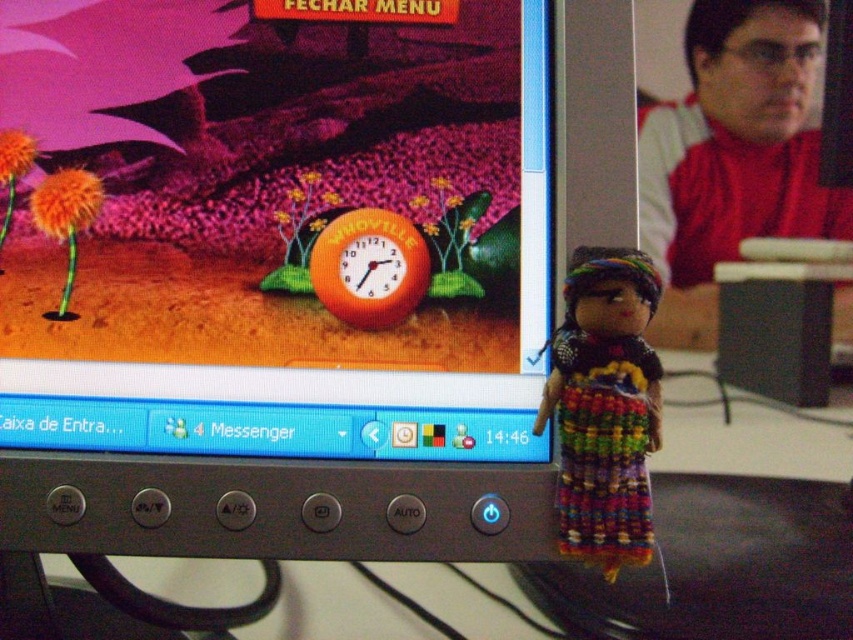
Question: Among these objects, which one is nearest to the camera?

Choices:
 (A) matte plastic monitor at center
 (B) fluffy orange flower at left

Answer: (A)

Question: Based on their relative distances, which object is farther from the knitted multicolored doll at right?

Choices:
 (A) fluffy orange flower at left
 (B) matte plastic monitor at center

Answer: (A)

Question: Can you confirm if orange fabric clock at center is wider than fluffy orange flower at left?

Choices:
 (A) yes
 (B) no

Answer: (A)

Question: Is smooth red shirt at right above orange fabric clock at center?

Choices:
 (A) no
 (B) yes

Answer: (B)

Question: Can you confirm if matte plastic monitor at center is positioned below fluffy orange flower at left?

Choices:
 (A) yes
 (B) no

Answer: (B)

Question: Among these objects, which one is farthest from the camera?

Choices:
 (A) matte plastic monitor at center
 (B) smooth red shirt at right
 (C) knitted multicolored doll at right
 (D) orange fabric clock at center

Answer: (B)